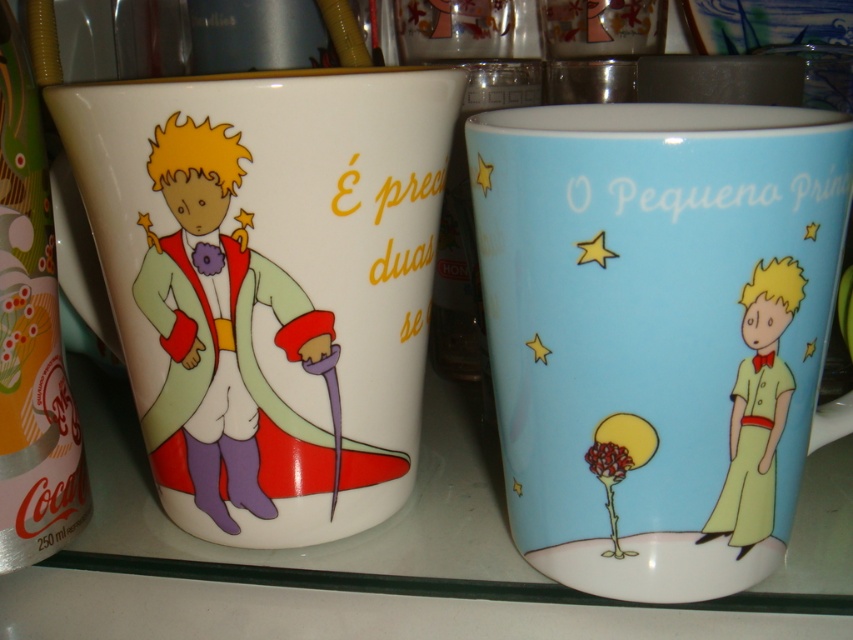
Question: Which point is farther from the camera taking this photo?

Choices:
 (A) (352, 113)
 (B) (689, 346)

Answer: (A)

Question: Is light blue ceramic mug at center closer to the viewer compared to white glossy mug at left?

Choices:
 (A) yes
 (B) no

Answer: (A)

Question: Observing the image, what is the correct spatial positioning of light blue ceramic mug at center in reference to white glossy mug at left?

Choices:
 (A) above
 (B) below

Answer: (B)

Question: Which point appears closest to the camera in this image?

Choices:
 (A) (709, 188)
 (B) (138, 266)

Answer: (A)

Question: Is light blue ceramic mug at center in front of white glossy mug at left?

Choices:
 (A) yes
 (B) no

Answer: (A)